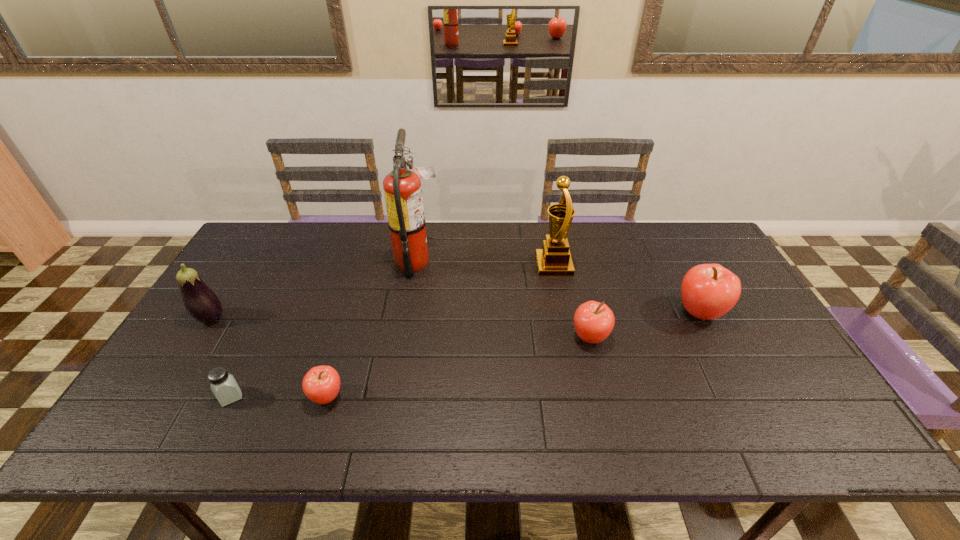
The width and height of the screenshot is (960, 540). In order to click on the leftmost apple in this screenshot , I will do `click(321, 384)`.

Where is `the shortest apple`? The width and height of the screenshot is (960, 540). the shortest apple is located at coordinates (321, 384).

Image resolution: width=960 pixels, height=540 pixels. I want to click on the second tallest apple, so click(x=593, y=321).

Where is `the second apple from left to right`? This screenshot has width=960, height=540. the second apple from left to right is located at coordinates (593, 321).

Find the location of `the tallest apple`. the tallest apple is located at coordinates (708, 291).

Locate an element on the screen. The image size is (960, 540). the rightmost apple is located at coordinates (708, 291).

You are a GUI agent. You are given a task and a screenshot of the screen. Output one action in this format:
    pyautogui.click(x=<x>, y=<y>)
    Task: Click on the fourth object from right to left
    The height and width of the screenshot is (540, 960).
    Given the screenshot: What is the action you would take?
    pyautogui.click(x=402, y=188)

Where is `the tallest object`? the tallest object is located at coordinates (402, 188).

Identify the location of award. (554, 259).

Image resolution: width=960 pixels, height=540 pixels. I want to click on the leftmost object, so click(202, 304).